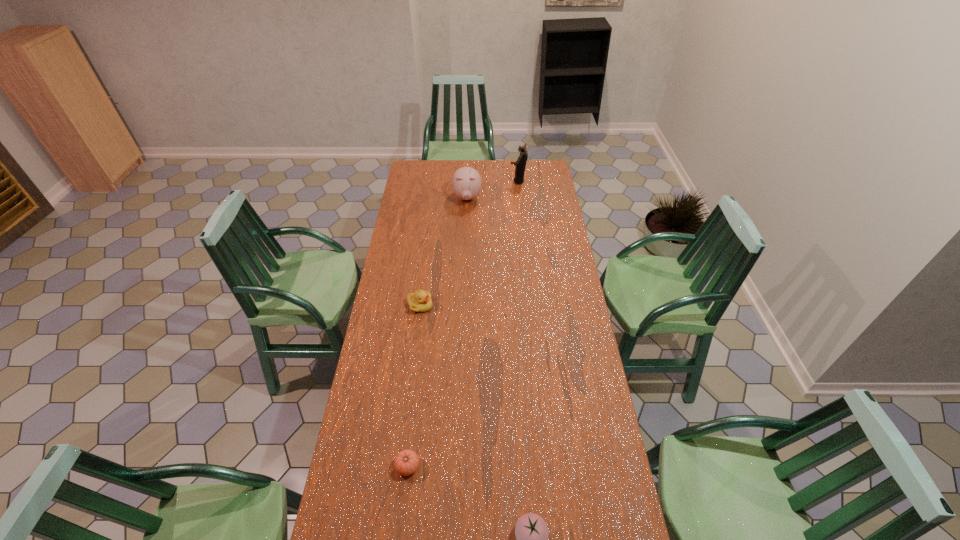
Find the location of `the tallest object`. the tallest object is located at coordinates (520, 165).

Where is `figurine`? figurine is located at coordinates (520, 165).

The height and width of the screenshot is (540, 960). Find the location of `the second farthest object`. the second farthest object is located at coordinates (466, 182).

The height and width of the screenshot is (540, 960). In order to click on piggy bank in this screenshot , I will do `click(466, 182)`.

Locate an element on the screen. Image resolution: width=960 pixels, height=540 pixels. duckling is located at coordinates (420, 301).

Identify the location of the farther tomato. (406, 462).

This screenshot has width=960, height=540. Identify the location of the shorter tomato. (406, 462).

Find the location of a particular element. The image size is (960, 540). vacant space located on the front-facing side of the farthest object is located at coordinates (464, 181).

Find the location of a particular element. free space located on the front-facing side of the farthest object is located at coordinates (455, 181).

Find the location of a particular element. This screenshot has height=540, width=960. vacant area situated 0.240m on the front-facing side of the farthest object is located at coordinates (470, 181).